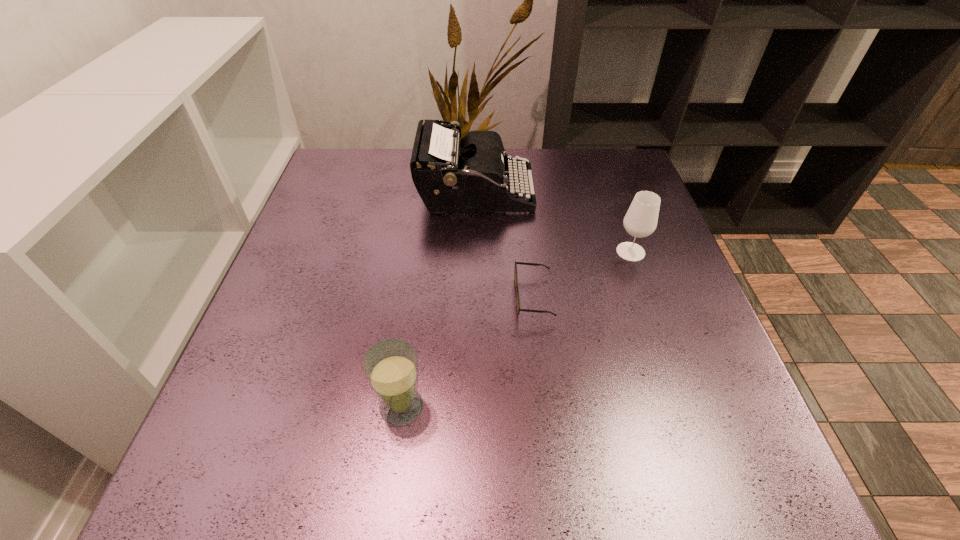
Identify the location of empty space that is in between the right glass and the typewriter. This screenshot has width=960, height=540. (553, 222).

Choose which object is the second nearest neighbor to the typewriter. Please provide its 2D coordinates. Your answer should be formatted as a tuple, i.e. [(x, y)], where the tuple contains the x and y coordinates of a point satisfying the conditions above.

[(641, 219)]

Identify which object is located as the second nearest to the shortest object. Please provide its 2D coordinates. Your answer should be formatted as a tuple, i.e. [(x, y)], where the tuple contains the x and y coordinates of a point satisfying the conditions above.

[(641, 219)]

Image resolution: width=960 pixels, height=540 pixels. In order to click on free space that satisfies the following two spatial constraints: 1. on the typing side of the rightmost object; 2. on the right side of the farthest object in this screenshot , I will do `click(475, 252)`.

Identify the location of free space that satisfies the following two spatial constraints: 1. on the back side of the third nearest object; 2. on the right side of the nearer glass. The width and height of the screenshot is (960, 540). (422, 252).